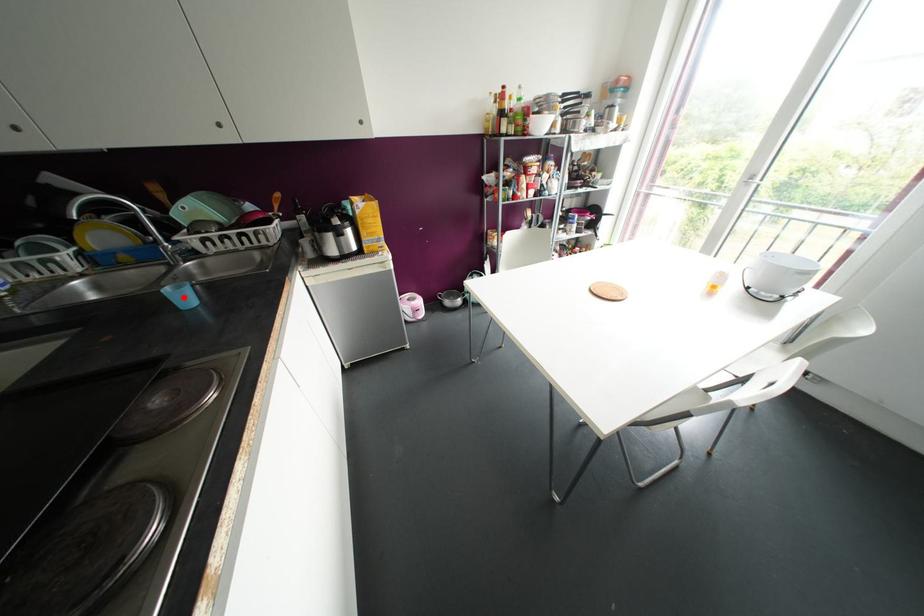
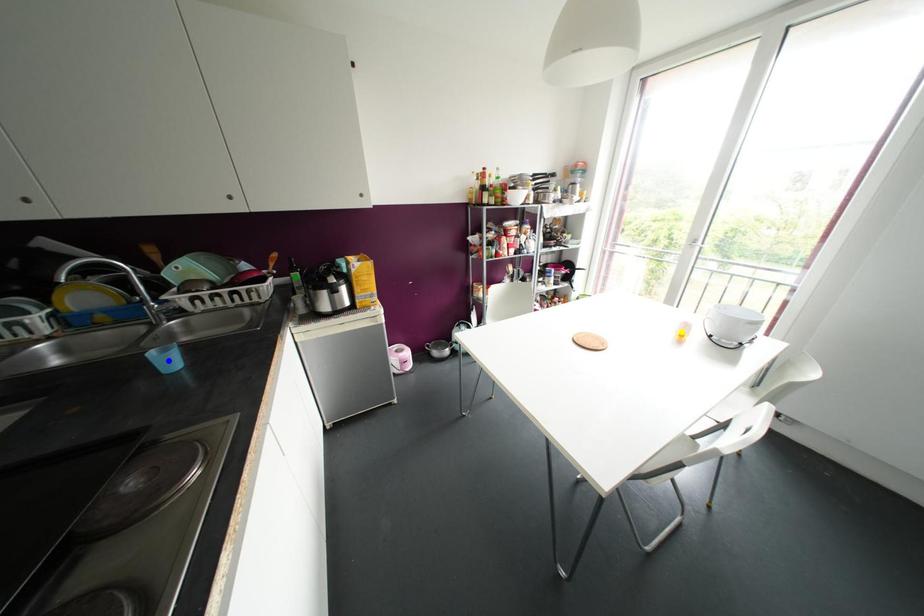
Question: I am providing you with two images of the same scene from different viewpoints. A red point is marked on the first image. You are given multiple points on the second image. Which point in image 2 represents the same 3d spot as the red point in image 1?

Choices:
 (A) yellow point
 (B) green point
 (C) blue point

Answer: (C)